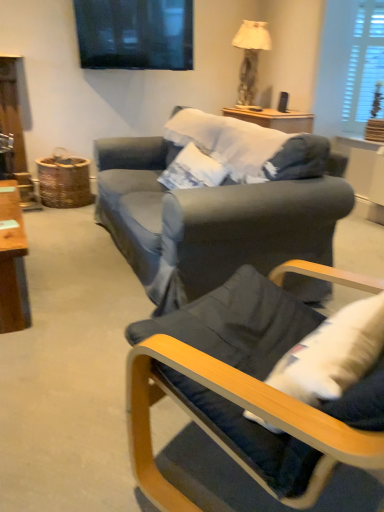
Question: From the image's perspective, would you say white wooden blinds at upper right is positioned over dark blue fabric chair at lower right?

Choices:
 (A) yes
 (B) no

Answer: (A)

Question: Is white wooden blinds at upper right shorter than dark blue fabric chair at lower right?

Choices:
 (A) no
 (B) yes

Answer: (A)

Question: Is white wooden blinds at upper right not close to dark blue fabric chair at lower right?

Choices:
 (A) yes
 (B) no

Answer: (A)

Question: Is white wooden blinds at upper right behind dark blue fabric chair at lower right?

Choices:
 (A) yes
 (B) no

Answer: (A)

Question: Considering the relative positions of white wooden blinds at upper right and dark blue fabric chair at lower right in the image provided, is white wooden blinds at upper right to the left of dark blue fabric chair at lower right from the viewer's perspective?

Choices:
 (A) yes
 (B) no

Answer: (B)

Question: From a real-world perspective, is white wooden blinds at upper right positioned over dark blue fabric chair at lower right based on gravity?

Choices:
 (A) no
 (B) yes

Answer: (B)

Question: Does matte beige lampshade at upper right have a greater height compared to dark blue fabric chair at lower right?

Choices:
 (A) no
 (B) yes

Answer: (B)

Question: Is the position of matte beige lampshade at upper right less distant than that of dark blue fabric chair at lower right?

Choices:
 (A) no
 (B) yes

Answer: (A)

Question: Is matte beige lampshade at upper right at the right side of dark blue fabric chair at lower right?

Choices:
 (A) yes
 (B) no

Answer: (A)

Question: From a real-world perspective, is matte beige lampshade at upper right physically below dark blue fabric chair at lower right?

Choices:
 (A) yes
 (B) no

Answer: (B)

Question: Considering the relative sizes of matte beige lampshade at upper right and dark blue fabric chair at lower right in the image provided, is matte beige lampshade at upper right bigger than dark blue fabric chair at lower right?

Choices:
 (A) yes
 (B) no

Answer: (A)

Question: Is matte beige lampshade at upper right further to camera compared to dark blue fabric chair at lower right?

Choices:
 (A) yes
 (B) no

Answer: (A)

Question: Can you see white wooden blinds at upper right touching matte beige lampshade at upper right?

Choices:
 (A) yes
 (B) no

Answer: (B)